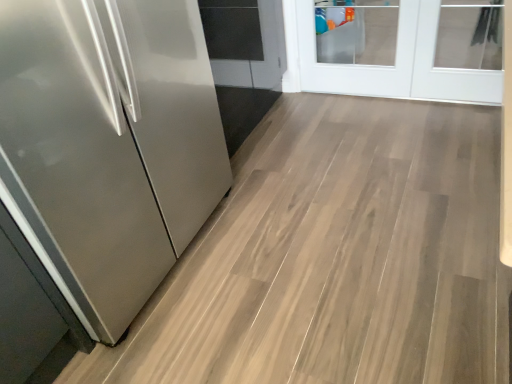
Locate an element on the screen. This screenshot has height=384, width=512. white glass door at upper right is located at coordinates (387, 66).

The image size is (512, 384). What do you see at coordinates (387, 66) in the screenshot? I see `white glass door at upper right` at bounding box center [387, 66].

The height and width of the screenshot is (384, 512). Describe the element at coordinates (108, 144) in the screenshot. I see `satin stainless steel refrigerator at left` at that location.

Identify the location of satin stainless steel refrigerator at left. (108, 144).

Identify the location of white glass door at upper right. The width and height of the screenshot is (512, 384). (387, 66).

Which object is positioned more to the left, satin stainless steel refrigerator at left or white glass door at upper right?

satin stainless steel refrigerator at left is more to the left.

Which is in front, satin stainless steel refrigerator at left or white glass door at upper right?

satin stainless steel refrigerator at left.

Between point (86, 109) and point (421, 16), which one is positioned behind?

Point (421, 16)

From the image's perspective, is satin stainless steel refrigerator at left on top of white glass door at upper right?

Actually, satin stainless steel refrigerator at left appears below white glass door at upper right in the image.

From a real-world perspective, between satin stainless steel refrigerator at left and white glass door at upper right, who is vertically higher?

In real-world perspective, satin stainless steel refrigerator at left is above.

Is satin stainless steel refrigerator at left thinner than white glass door at upper right?

No, satin stainless steel refrigerator at left is not thinner than white glass door at upper right.

Does satin stainless steel refrigerator at left have a lesser height compared to white glass door at upper right?

Incorrect, the height of satin stainless steel refrigerator at left does not fall short of that of white glass door at upper right.

Can you confirm if satin stainless steel refrigerator at left is bigger than white glass door at upper right?

Correct, satin stainless steel refrigerator at left is larger in size than white glass door at upper right.

Is satin stainless steel refrigerator at left situated inside white glass door at upper right or outside?

satin stainless steel refrigerator at left cannot be found inside white glass door at upper right.

Is satin stainless steel refrigerator at left placed right next to white glass door at upper right?

No, satin stainless steel refrigerator at left is not with white glass door at upper right.

Is satin stainless steel refrigerator at left positioned with its back to white glass door at upper right?

satin stainless steel refrigerator at left does not have its back to white glass door at upper right.

How many degrees apart are the facing directions of satin stainless steel refrigerator at left and white glass door at upper right?

90.5 degrees separate the facing orientations of satin stainless steel refrigerator at left and white glass door at upper right.

In the scene shown: Measure the distance between satin stainless steel refrigerator at left and white glass door at upper right.

satin stainless steel refrigerator at left is 1.56 meters away from white glass door at upper right.

Find the location of `refrigerator above the white glass door at upper right (from a real-world perspective)`. refrigerator above the white glass door at upper right (from a real-world perspective) is located at coordinates (108, 144).

Would you say white glass door at upper right is to the left or to the right of satin stainless steel refrigerator at left in the picture?

From the image, it's evident that white glass door at upper right is to the right of satin stainless steel refrigerator at left.

Does white glass door at upper right come behind satin stainless steel refrigerator at left?

Yes, white glass door at upper right is further from the camera.

Does point (411, 76) appear closer or farther from the camera than point (153, 215)?

Point (411, 76) is positioned farther from the camera compared to point (153, 215).

From the image's perspective, is white glass door at upper right beneath satin stainless steel refrigerator at left?

No, from the image's perspective, white glass door at upper right is not beneath satin stainless steel refrigerator at left.

From a real-world perspective, between white glass door at upper right and satin stainless steel refrigerator at left, who is vertically higher?

Answer: satin stainless steel refrigerator at left.

In terms of width, does white glass door at upper right look wider or thinner when compared to satin stainless steel refrigerator at left?

Clearly, white glass door at upper right has less width compared to satin stainless steel refrigerator at left.

From their relative heights in the image, would you say white glass door at upper right is taller or shorter than satin stainless steel refrigerator at left?

In the image, white glass door at upper right appears to be shorter than satin stainless steel refrigerator at left.

Can you confirm if white glass door at upper right is bigger than satin stainless steel refrigerator at left?

Actually, white glass door at upper right might be smaller than satin stainless steel refrigerator at left.

Is white glass door at upper right not within satin stainless steel refrigerator at left?

That's correct, white glass door at upper right is outside of satin stainless steel refrigerator at left.

Is the surface of white glass door at upper right in direct contact with satin stainless steel refrigerator at left?

There is a gap between white glass door at upper right and satin stainless steel refrigerator at left.

Is white glass door at upper right facing towards satin stainless steel refrigerator at left?

Yes, white glass door at upper right is oriented towards satin stainless steel refrigerator at left.

Locate an element on the screen. The width and height of the screenshot is (512, 384). refrigerator located above the white glass door at upper right (from a real-world perspective) is located at coordinates (108, 144).

Find the location of a particular element. refrigerator in front of the white glass door at upper right is located at coordinates (108, 144).

Where is `refrigerator on the left of the white glass door at upper right`? Image resolution: width=512 pixels, height=384 pixels. refrigerator on the left of the white glass door at upper right is located at coordinates (108, 144).